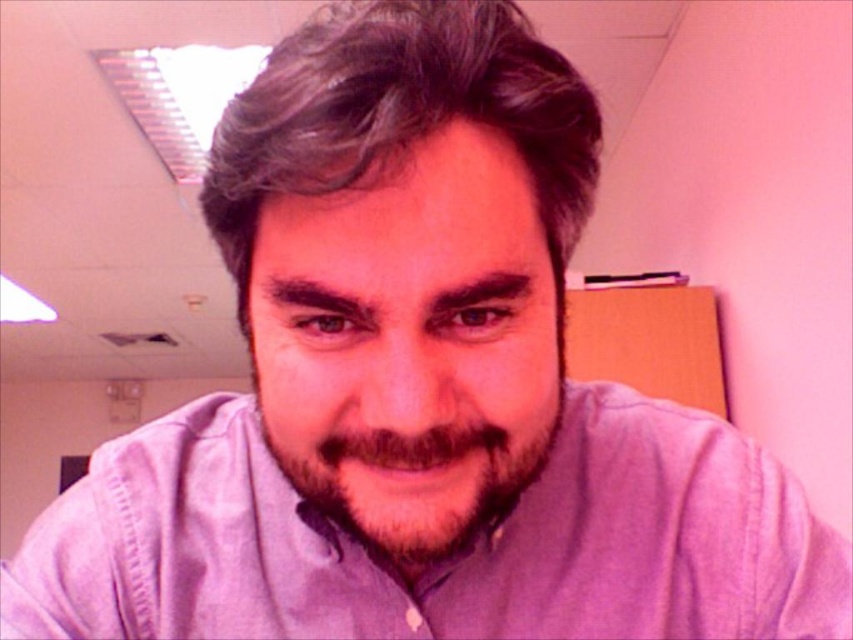
Consider the image. You are an interior designer assessing the lighting in this room. The purple cotton shirt at center and gray matte hair at center are both in the frame. Which object is positioned lower in the image?

The purple cotton shirt at center is below gray matte hair at center, so the purple cotton shirt at center is positioned lower in the image.

Looking at this image, you are standing in the office scene described. There are two points marked in the image. The first point is at coordinate point (585, 557) and the second is at point (383, 451). If you were to draw a straight line from your current position to each point, which point would require the line to pass through the other point before reaching it?

Point (585, 557) is behind point (383, 451), so the line to point (585, 557) would have to pass through point (383, 451) first.